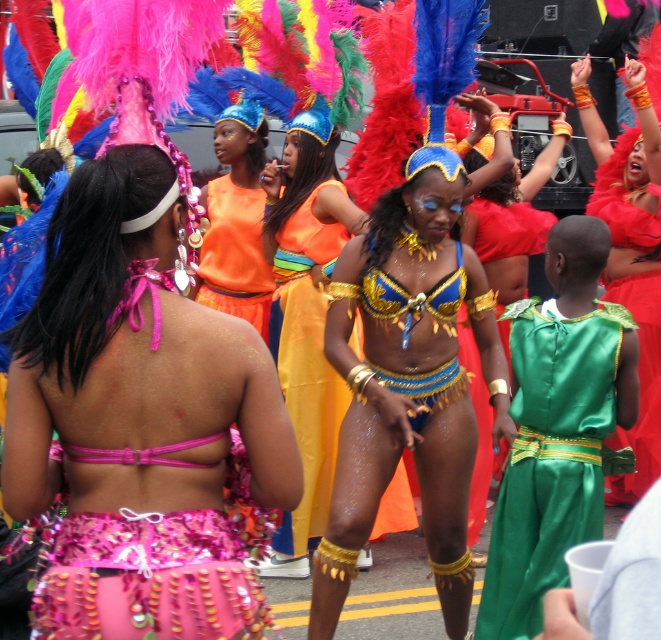
You are a photographer at the carnival trying to capture the most prominent feature in the center of the image. Which object should you focus on, the shiny red feather headdress at center or the orange fabric skirt at center?

The shiny red feather headdress at center has a larger size compared to the orange fabric skirt at center, so you should focus on the shiny red feather headdress at center as it is more prominent.